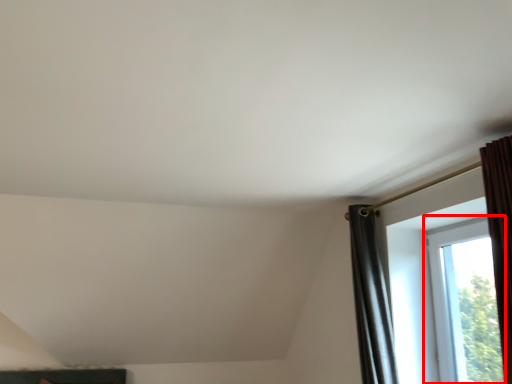
Question: From the image's perspective, where is window (annotated by the red box) located relative to window?

Choices:
 (A) below
 (B) above

Answer: (A)